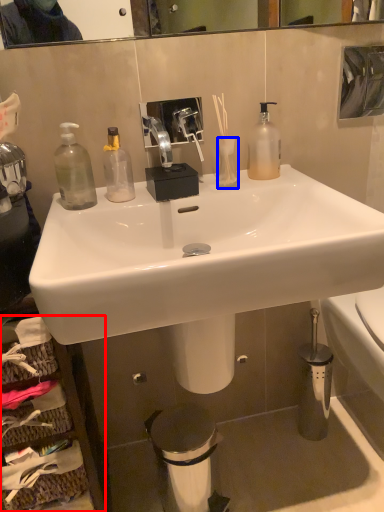
Question: Among these objects, which one is nearest to the camera, cabinetry (highlighted by a red box) or vase (highlighted by a blue box)?

Choices:
 (A) cabinetry
 (B) vase

Answer: (A)